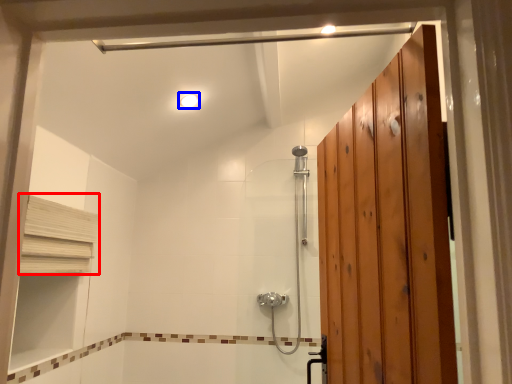
Question: Which point is further to the camera, shelf (highlighted by a red box) or light fixture (highlighted by a blue box)?

Choices:
 (A) shelf
 (B) light fixture

Answer: (B)